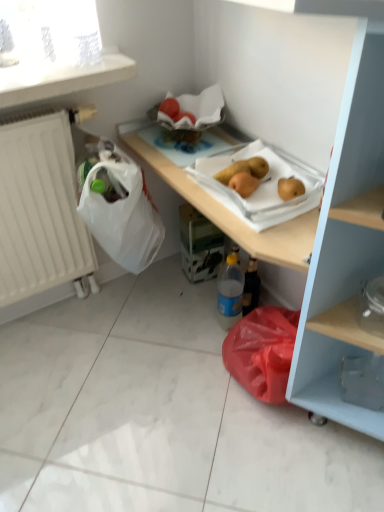
I want to click on vacant area in front of blue plastic bottle at lower center, so [211, 366].